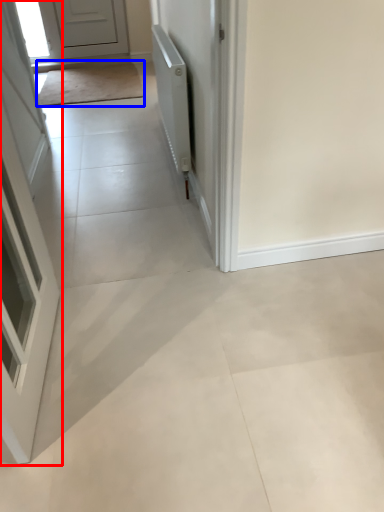
Question: Which object appears closest to the camera in this image, door (highlighted by a red box) or mat (highlighted by a blue box)?

Choices:
 (A) door
 (B) mat

Answer: (A)